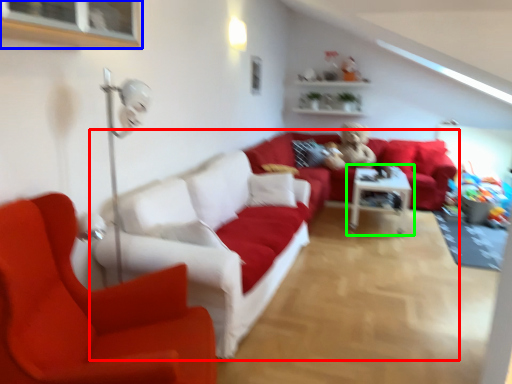
Question: Estimate the real-world distances between objects in this image. Which object is closer to studio couch (highlighted by a red box), window (highlighted by a blue box) or table (highlighted by a green box)?

Choices:
 (A) window
 (B) table

Answer: (A)